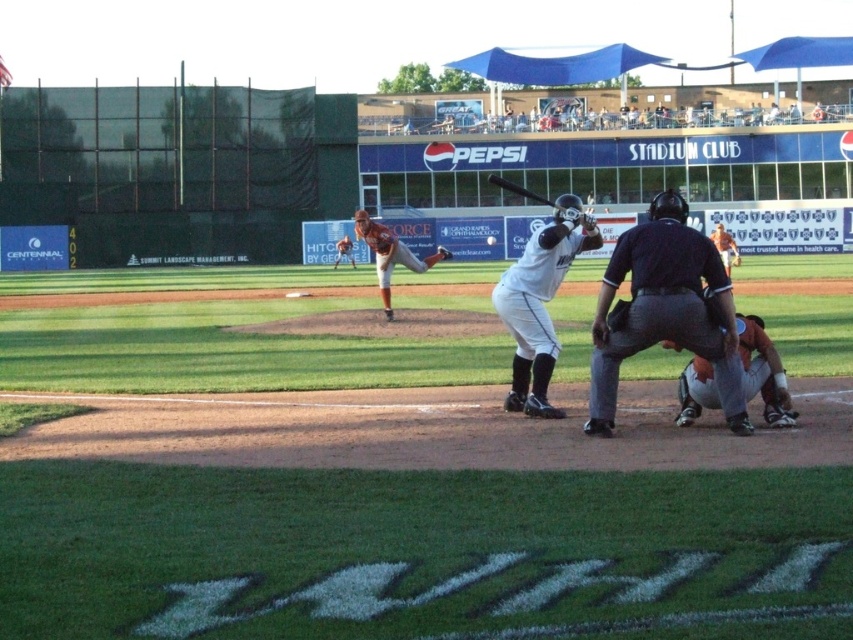
Question: Which point appears closest to the camera in this image?

Choices:
 (A) (489, 241)
 (B) (729, 243)

Answer: (B)

Question: Can you confirm if dark blue uniform at center is positioned to the right of orange uniformed pitcher at center?

Choices:
 (A) yes
 (B) no

Answer: (A)

Question: Does orange jersey at center lie behind brown leather glove at center?

Choices:
 (A) yes
 (B) no

Answer: (B)

Question: Which point is closer to the camera?

Choices:
 (A) white matte baseball at center
 (B) dark blue uniform at center
 (C) orange jersey at center
 (D) black matte bat at center

Answer: (B)

Question: Is dark blue uniform at center wider than orange uniform catcher at lower right?

Choices:
 (A) yes
 (B) no

Answer: (A)

Question: Which point is closer to the camera?

Choices:
 (A) brown leather glove at center
 (B) orange jersey at center
 (C) white matte baseball at center

Answer: (B)